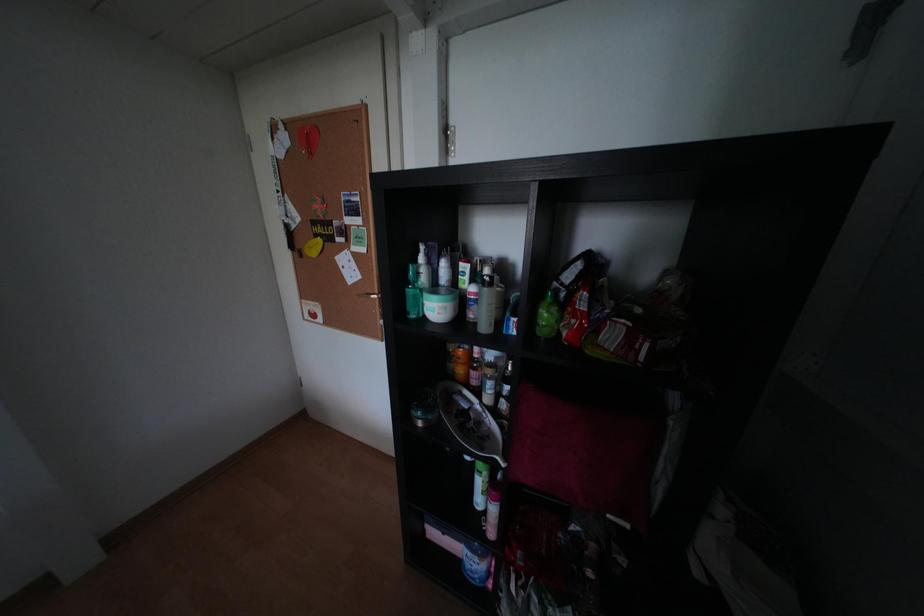
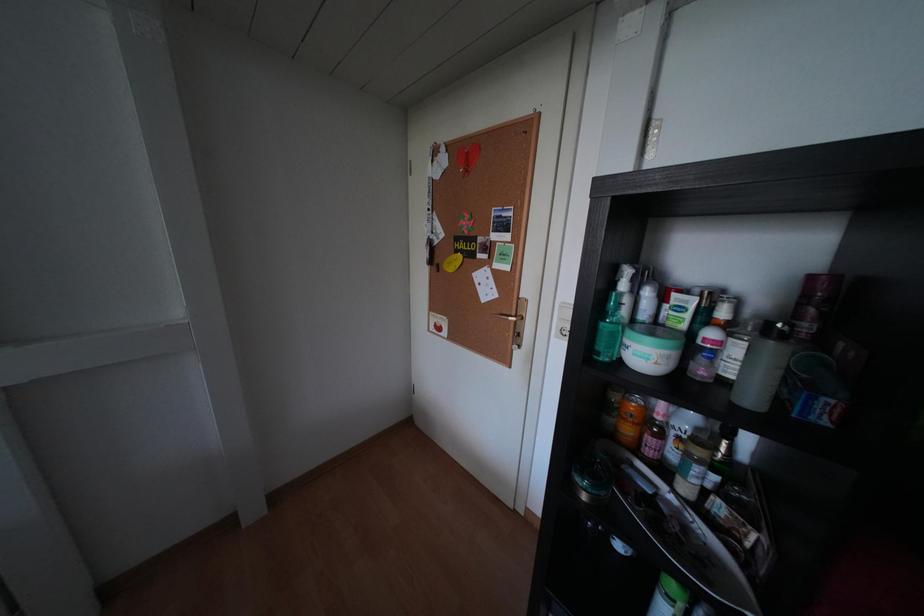
Question: The camera is either moving clockwise (left) or counter-clockwise (right) around the object. The first image is from the beginning of the video and the second image is from the end. Is the camera moving left or right when shooting the video?

Choices:
 (A) Left
 (B) Right

Answer: (B)